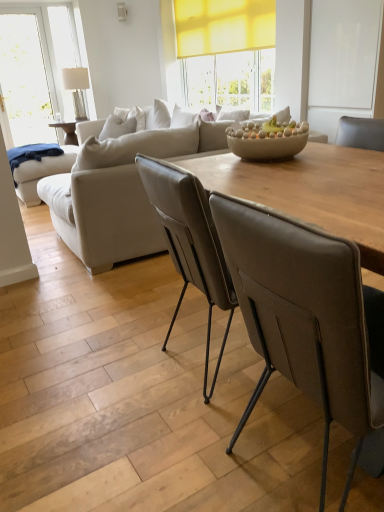
Measure the distance between point (82, 238) and camera.

Point (82, 238) and camera are 2.59 meters apart.

Locate an element on the screen. beige leather couch at center is located at coordinates (118, 191).

The height and width of the screenshot is (512, 384). Describe the element at coordinates (325, 191) in the screenshot. I see `wooden table at center` at that location.

This screenshot has width=384, height=512. What are the coordinates of `clear glass lamp at upper left` in the screenshot? It's located at (77, 89).

The image size is (384, 512). Find the location of `beige leather couch at center`. beige leather couch at center is located at coordinates (118, 191).

Would you consider brown leather chair at center to be distant from wooden table at center?

Actually, brown leather chair at center and wooden table at center are a little close together.

Does point (307, 229) come farther from viewer compared to point (331, 221)?

That is False.

Is brown leather chair at center positioned behind wooden table at center?

No, the depth of brown leather chair at center is less than that of wooden table at center.

Could you tell me if brown leather chair at center is facing wooden table at center?

No.

From a real-world perspective, is wooden table at center on beige leather couch at center?

No, from a real-world perspective, wooden table at center is not above beige leather couch at center.

Is wooden table at center turned away from beige leather couch at center?

wooden table at center is not turned away from beige leather couch at center.

Looking at this image, is wooden table at center far from beige leather couch at center?

wooden table at center is positioned a significant distance from beige leather couch at center.

From the image's perspective, is wooden table at center positioned above or below beige leather couch at center?

wooden table at center is below beige leather couch at center.

Is brown leather chair at center beside clear glass lamp at upper left?

brown leather chair at center and clear glass lamp at upper left are clearly separated.

Which is closer, (307, 267) or (78, 92)?

The point (307, 267) is more forward.

Can we say brown leather chair at center lies outside clear glass lamp at upper left?

Absolutely, brown leather chair at center is external to clear glass lamp at upper left.

Considering the relative sizes of brown leather chair at center and clear glass lamp at upper left in the image provided, is brown leather chair at center smaller than clear glass lamp at upper left?

No.

Does wooden table at center have a larger size compared to brown leather chair at center?

Actually, wooden table at center might be smaller than brown leather chair at center.

Considering the sizes of wooden table at center and brown leather chair at center in the image, is wooden table at center wider or thinner than brown leather chair at center?

In the image, wooden table at center appears to be more narrow than brown leather chair at center.

From a real-world perspective, is wooden table at center on top of brown leather chair at center?

Yes, from a real-world perspective, wooden table at center is above brown leather chair at center.

Between wooden table at center and brown leather chair at center, which one is positioned behind?

wooden table at center is more distant.

From a real-world perspective, is clear glass lamp at upper left positioned over beige leather couch at center based on gravity?

Yes, from a real-world perspective, clear glass lamp at upper left is over beige leather couch at center

In the scene shown: Between clear glass lamp at upper left and beige leather couch at center, which one has larger size?

Bigger between the two is beige leather couch at center.

In terms of width, does clear glass lamp at upper left look wider or thinner when compared to beige leather couch at center?

Clearly, clear glass lamp at upper left has less width compared to beige leather couch at center.

Is wooden table at center at the back of beige leather couch at center?

No, beige leather couch at center is not facing the opposite direction of wooden table at center.

How different are the orientations of beige leather couch at center and wooden table at center in degrees?

177 degrees separate the facing orientations of beige leather couch at center and wooden table at center.

Is beige leather couch at center positioned in front of wooden table at center?

No, beige leather couch at center is further to the viewer.

From the image's perspective, between beige leather couch at center and wooden table at center, who is located below?

wooden table at center, from the image's perspective.

Is point (196, 124) positioned before point (79, 118)?

Yes.

Who is smaller, beige leather couch at center or clear glass lamp at upper left?

clear glass lamp at upper left is smaller.

Are beige leather couch at center and clear glass lamp at upper left far apart?

Yes, beige leather couch at center and clear glass lamp at upper left are located far from each other.

Considering their positions, is beige leather couch at center located in front of or behind clear glass lamp at upper left?

beige leather couch at center is in front of clear glass lamp at upper left.

This screenshot has height=512, width=384. Identify the location of table above the brown leather chair at center (from the image's perspective). (325, 191).

Where is `studio couch behind the wooden table at center`? studio couch behind the wooden table at center is located at coordinates (118, 191).

Estimate the real-world distances between objects in this image. Which object is closer to wooden table at center, beige leather couch at center or brown leather chair at center?

brown leather chair at center is closer to wooden table at center.

When comparing their distances from brown leather chair at center, does wooden table at center or beige leather couch at center seem closer?

wooden table at center is positioned closer to the anchor brown leather chair at center.

Considering their positions, is brown leather chair at center positioned closer to beige leather couch at center than clear glass lamp at upper left?

brown leather chair at center is positioned closer to the anchor beige leather couch at center.

Considering their positions, is brown leather chair at center positioned closer to clear glass lamp at upper left than wooden table at center?

Among the two, wooden table at center is located nearer to clear glass lamp at upper left.

Looking at this image, when comparing their distances from wooden table at center, does clear glass lamp at upper left or beige leather couch at center seem closer?

beige leather couch at center lies closer to wooden table at center than the other object.

When comparing their distances from brown leather chair at center, does clear glass lamp at upper left or beige leather couch at center seem further?

Based on the image, clear glass lamp at upper left appears to be further to brown leather chair at center.

From the image, which object appears to be nearer to beige leather couch at center, wooden table at center or clear glass lamp at upper left?

wooden table at center.

Which object lies nearer to the anchor point beige leather couch at center, brown leather chair at center or wooden table at center?

Based on the image, wooden table at center appears to be nearer to beige leather couch at center.

Where is `studio couch located between wooden table at center and clear glass lamp at upper left in the depth direction`? The image size is (384, 512). studio couch located between wooden table at center and clear glass lamp at upper left in the depth direction is located at coordinates (118, 191).

Find the location of a particular element. This screenshot has height=512, width=384. table between brown leather chair at center and clear glass lamp at upper left from front to back is located at coordinates (325, 191).

You are a GUI agent. You are given a task and a screenshot of the screen. Output one action in this format:
    pyautogui.click(x=<x>, y=<y>)
    Task: Click on the studio couch positioned between brown leather chair at center and clear glass lamp at upper left from near to far
    Image resolution: width=384 pixels, height=512 pixels.
    Given the screenshot: What is the action you would take?
    pyautogui.click(x=118, y=191)

Identify the location of table between brown leather chair at center and beige leather couch at center in the front-back direction. This screenshot has height=512, width=384. (325, 191).